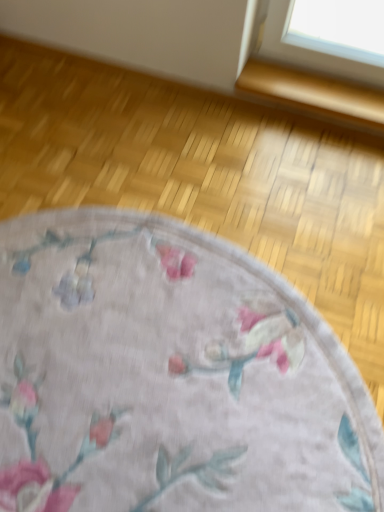
What do you see at coordinates (314, 93) in the screenshot? I see `gold wood window sill at upper right` at bounding box center [314, 93].

The image size is (384, 512). Identify the location of gold wood window sill at upper right. (314, 93).

You are a GUI agent. You are given a task and a screenshot of the screen. Output one action in this format:
    pyautogui.click(x=<x>, y=<y>)
    Task: Click on the gold wood window sill at upper right
    
    Given the screenshot: What is the action you would take?
    pyautogui.click(x=314, y=93)